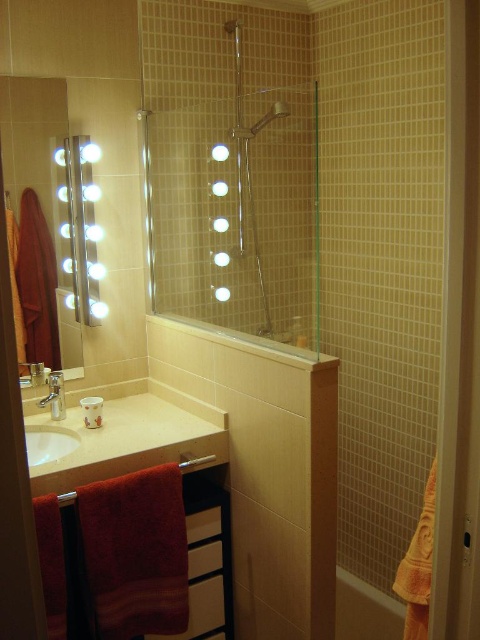
You are designing a bathroom layout and need to ensure that the matte black mirror at left and the brushed metal faucet at sink left fit within a 1.2 meter wide space. Given their widths, can both items be placed side by side without overlapping?

The matte black mirror at left is wider than the brushed metal faucet at sink left. However, since the exact widths aren

You are standing in the bathroom and need to locate the transparent glass shower door at upper center. Based on the 2D coordinates provided, can you estimate its position relative to the bathroom walls?

The transparent glass shower door at upper center is located at coordinates 0.287 along the horizontal axis and 0.475 along the vertical axis, meaning it is positioned closer to the left side of the bathroom and slightly above the midpoint vertically.

From the picture: You are a plumber inspecting the bathroom layout. You notice the transparent glass shower door at upper center and the brushed metal faucet at sink left. According to the bathroom design, is the shower door located above the faucet?

Yes, the transparent glass shower door at upper center is positioned over the brushed metal faucet at sink left, so the shower door is indeed located above the faucet.